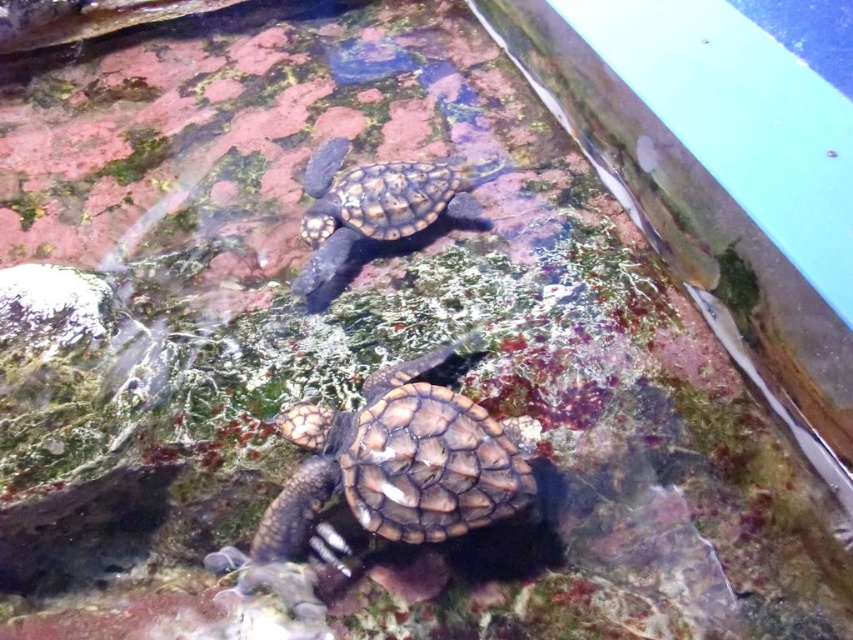
You are a caretaker trying to place both the brown scaly tortoise at center and the leathery brown tortoise at upper center into a transport container that can only hold one tortoise at a time. Based on their sizes, which tortoise should you move first to ensure the container can accommodate both?

The brown scaly tortoise at center might be wider than the leathery brown tortoise at upper center, so you should move the leathery brown tortoise at upper center first to ensure the container can accommodate both.

You are a researcher observing two baby turtles in an aquarium. You notice their exact positions are marked as point 1 at (392,477) and point 2 at 0.652, 0.539. Based on the coordinates, how far apart are the two turtles in feet?

The two turtles are 4.45 feet apart.

You are a marine biologist observing two tortoises in an aquarium. You need to determine which one is nearer to you. The tortoises are the brown scaly tortoise at center and the leathery brown tortoise at upper center. Can you identify which one is closer?

The brown scaly tortoise at center is closer to the viewer than the leathery brown tortoise at upper center.